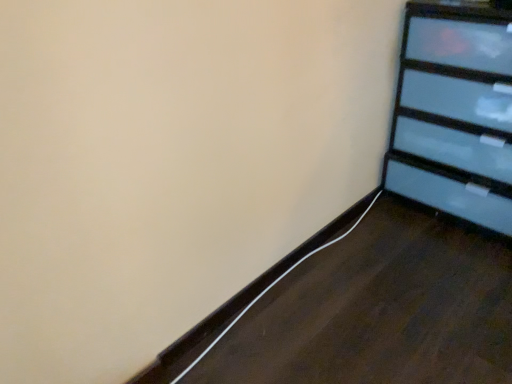
Identify the location of white matte cable at lower left. This screenshot has width=512, height=384. (269, 289).

The image size is (512, 384). What do you see at coordinates (269, 289) in the screenshot? I see `white matte cable at lower left` at bounding box center [269, 289].

The image size is (512, 384). What do you see at coordinates (455, 112) in the screenshot?
I see `black glossy dresser at upper right` at bounding box center [455, 112].

Where is `black glossy dresser at upper right`? black glossy dresser at upper right is located at coordinates (455, 112).

What is the approximate height of black glossy dresser at upper right?

black glossy dresser at upper right is 33.77 inches tall.

This screenshot has width=512, height=384. Find the location of `white matte cable at lower left`. white matte cable at lower left is located at coordinates (269, 289).

Considering the relative positions of black glossy dresser at upper right and white matte cable at lower left in the image provided, is black glossy dresser at upper right to the left or to the right of white matte cable at lower left?

From the image, it's evident that black glossy dresser at upper right is to the right of white matte cable at lower left.

Who is more distant, black glossy dresser at upper right or white matte cable at lower left?

white matte cable at lower left is behind.

Based on the photo, which is farther, (450, 99) or (248, 308)?

The point (450, 99) is farther.

From the image's perspective, which object appears higher, black glossy dresser at upper right or white matte cable at lower left?

black glossy dresser at upper right.

From a real-world perspective, does black glossy dresser at upper right sit lower than white matte cable at lower left?

Actually, black glossy dresser at upper right is physically above white matte cable at lower left in the real world.

Does black glossy dresser at upper right have a lesser width compared to white matte cable at lower left?

Incorrect, the width of black glossy dresser at upper right is not less than that of white matte cable at lower left.

In terms of height, does black glossy dresser at upper right look taller or shorter compared to white matte cable at lower left?

Considering their sizes, black glossy dresser at upper right has more height than white matte cable at lower left.

Is black glossy dresser at upper right bigger than white matte cable at lower left?

Yes, black glossy dresser at upper right is bigger than white matte cable at lower left.

Is black glossy dresser at upper right inside the boundaries of white matte cable at lower left, or outside?

black glossy dresser at upper right lies outside white matte cable at lower left.

In the scene shown: Is there a large distance between black glossy dresser at upper right and white matte cable at lower left?

They are positioned close to each other.

Could you tell me if black glossy dresser at upper right is facing white matte cable at lower left?

Yes, black glossy dresser at upper right is aimed at white matte cable at lower left.

Identify the location of cable below the black glossy dresser at upper right (from the image's perspective). (269, 289).

Would you say white matte cable at lower left is to the left or to the right of black glossy dresser at upper right in the picture?

From the image, it's evident that white matte cable at lower left is to the left of black glossy dresser at upper right.

Is the position of white matte cable at lower left less distant than that of black glossy dresser at upper right?

No, the depth of white matte cable at lower left is greater than that of black glossy dresser at upper right.

Does point (358, 221) come farther from viewer compared to point (428, 1)?

Yes, point (358, 221) is behind point (428, 1).

From the image's perspective, between white matte cable at lower left and black glossy dresser at upper right, which one is located above?

From the image's view, black glossy dresser at upper right is above.

From a real-world perspective, which object rests below the other?

white matte cable at lower left, from a real-world perspective.

Can you confirm if white matte cable at lower left is wider than black glossy dresser at upper right?

Incorrect, the width of white matte cable at lower left does not surpass that of black glossy dresser at upper right.

Looking at this image, considering the sizes of objects white matte cable at lower left and black glossy dresser at upper right in the image provided, who is taller, white matte cable at lower left or black glossy dresser at upper right?

black glossy dresser at upper right.

Based on their sizes in the image, would you say white matte cable at lower left is bigger or smaller than black glossy dresser at upper right?

Considering their sizes, white matte cable at lower left takes up less space than black glossy dresser at upper right.

Is white matte cable at lower left not within black glossy dresser at upper right?

Yes, white matte cable at lower left is located beyond the bounds of black glossy dresser at upper right.

Is white matte cable at lower left far from black glossy dresser at upper right?

No.

Is white matte cable at lower left facing away from black glossy dresser at upper right?

white matte cable at lower left does not have its back to black glossy dresser at upper right.

How much distance is there between white matte cable at lower left and black glossy dresser at upper right?

white matte cable at lower left and black glossy dresser at upper right are 25.56 inches apart from each other.

Where is `cable beneath the black glossy dresser at upper right (from a real-world perspective)`? The width and height of the screenshot is (512, 384). cable beneath the black glossy dresser at upper right (from a real-world perspective) is located at coordinates (269, 289).

Image resolution: width=512 pixels, height=384 pixels. Identify the location of cable on the left of black glossy dresser at upper right. (269, 289).

Locate an element on the screen. This screenshot has width=512, height=384. cable that is under the black glossy dresser at upper right (from a real-world perspective) is located at coordinates (269, 289).